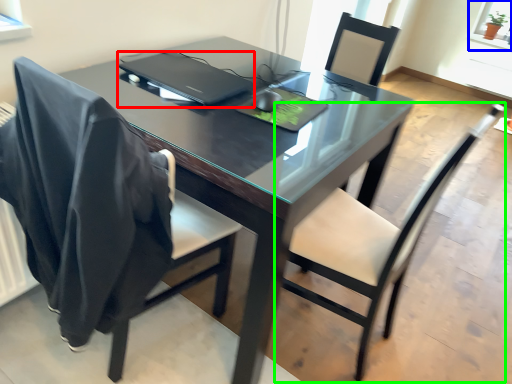
Question: Which is nearer to the laptop (highlighted by a red box)? window screen (highlighted by a blue box) or chair (highlighted by a green box).

Choices:
 (A) window screen
 (B) chair

Answer: (B)